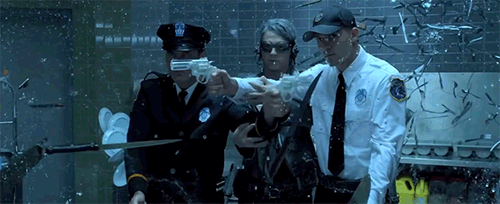
This screenshot has width=500, height=204. What are the coordinates of `door` in the screenshot? It's located at (42, 115).